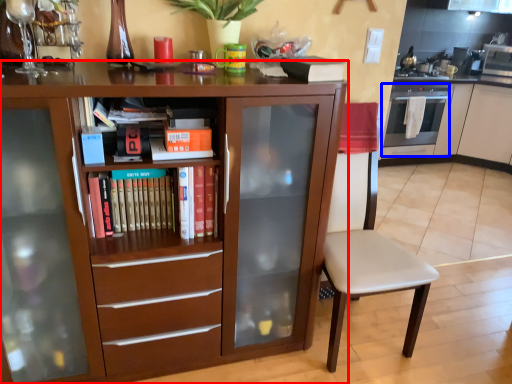
Question: Among these objects, which one is farthest to the camera, cabinetry (highlighted by a red box) or oven (highlighted by a blue box)?

Choices:
 (A) cabinetry
 (B) oven

Answer: (B)